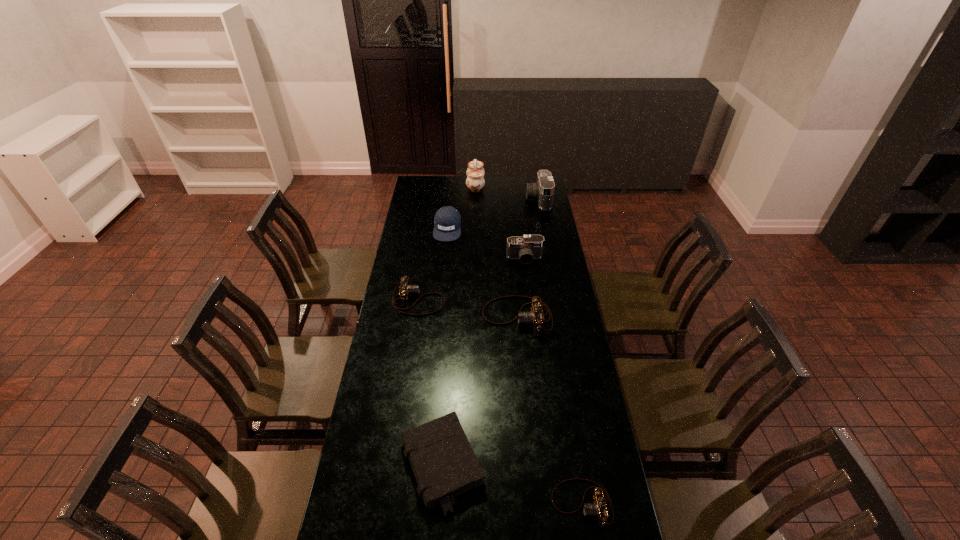
Locate which brown camera ranks second in proximity to the tallest camera. Please provide its 2D coordinates. Your answer should be formatted as a tuple, i.e. [(x, y)], where the tuple contains the x and y coordinates of a point satisfying the conditions above.

[(405, 289)]

Locate an element on the screen. Image resolution: width=960 pixels, height=540 pixels. the second closest brown camera relative to the biggest brown camera is located at coordinates (597, 509).

Identify the location of vacant space that satisfies the following two spatial constraints: 1. on the front-facing side of the baseball cap; 2. on the left side of the Bible. The image size is (960, 540). (425, 465).

Find the location of a particular element. This screenshot has width=960, height=540. vacant space that satisfies the following two spatial constraints: 1. on the front-facing side of the baseball cap; 2. on the front-facing side of the leftmost brown camera is located at coordinates (441, 300).

I want to click on free space that satisfies the following two spatial constraints: 1. on the back side of the Bible; 2. on the front-facing side of the second shortest camera, so click(453, 300).

You are a GUI agent. You are given a task and a screenshot of the screen. Output one action in this format:
    pyautogui.click(x=<x>, y=<y>)
    Task: Click on the free space that satisfies the following two spatial constraints: 1. on the front-facing side of the Bible; 2. on the right side of the fourth tallest camera
    The height and width of the screenshot is (540, 960).
    Given the screenshot: What is the action you would take?
    pyautogui.click(x=395, y=465)